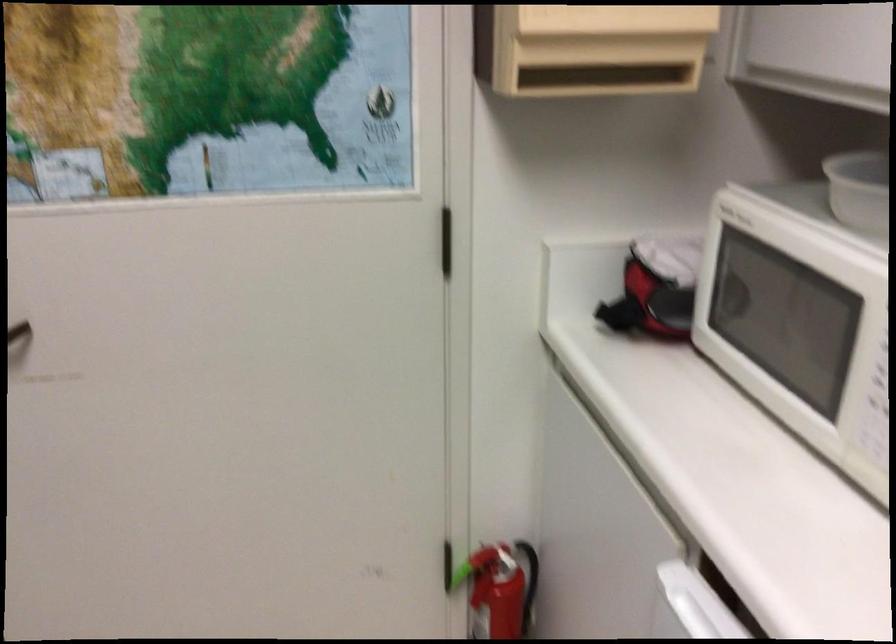
Where is `white drawer handle`? This screenshot has width=896, height=644. white drawer handle is located at coordinates (591, 489).